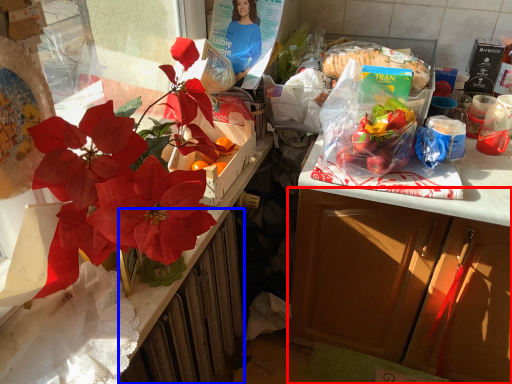
Question: Which object appears farthest to the camera in this image, cabinetry (highlighted by a red box) or radiator (highlighted by a blue box)?

Choices:
 (A) cabinetry
 (B) radiator

Answer: (B)